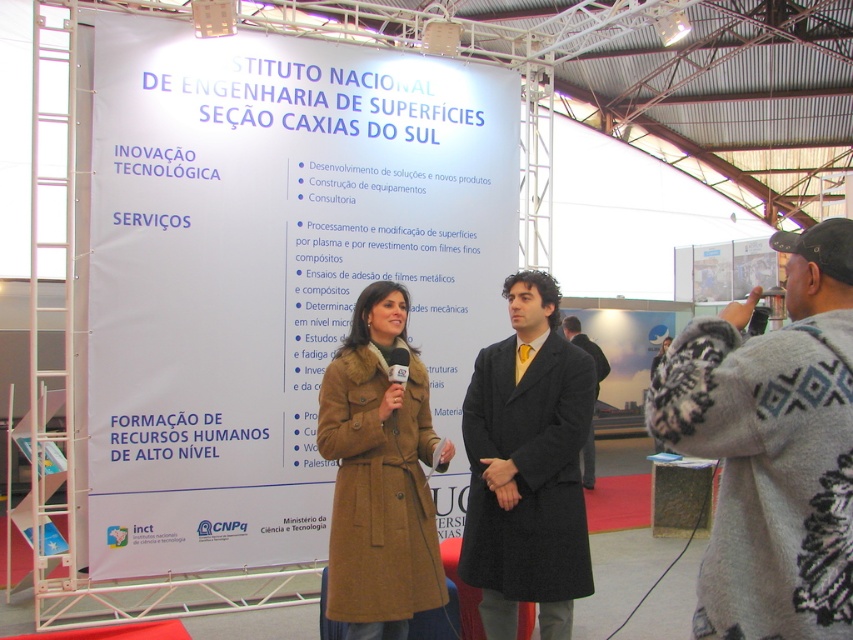
You are a photographer at the event and need to capture both the knitted gray sweater at right and the dark gray coat at center in a single shot. Which one should you focus on first to ensure both are in frame?

The knitted gray sweater at right is located above the dark gray coat at center, so focusing on the coat first and adjusting the camera angle downward will ensure both are in frame.

You are at the trade show booth and want to pick up the knitted gray sweater at right and the dark gray coat at center. Which one can you reach first without moving your position?

The knitted gray sweater at right is closer to the viewer than the dark gray coat at center, so you can reach the knitted gray sweater at right first without moving your position.